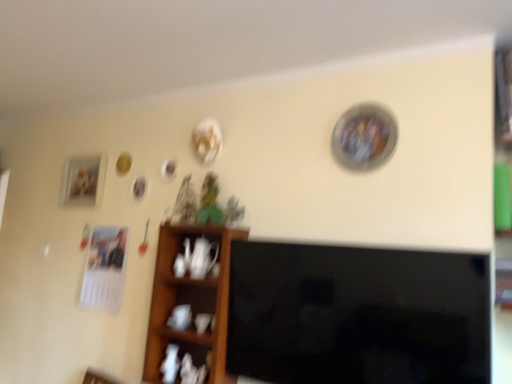
Question: Is black glossy tv at center bigger than wooden shelf at center?

Choices:
 (A) no
 (B) yes

Answer: (B)

Question: Can you confirm if black glossy tv at center is smaller than wooden shelf at center?

Choices:
 (A) no
 (B) yes

Answer: (A)

Question: From the image's perspective, would you say black glossy tv at center is shown under wooden shelf at center?

Choices:
 (A) yes
 (B) no

Answer: (B)

Question: From the image's perspective, is black glossy tv at center over wooden shelf at center?

Choices:
 (A) no
 (B) yes

Answer: (B)

Question: From a real-world perspective, is black glossy tv at center on wooden shelf at center?

Choices:
 (A) no
 (B) yes

Answer: (B)

Question: Could wooden shelf at center be considered to be inside black glossy tv at center?

Choices:
 (A) no
 (B) yes

Answer: (A)

Question: Does wooden shelf at center appear on the left side of matte wooden picture frame at left?

Choices:
 (A) yes
 (B) no

Answer: (B)

Question: Does wooden shelf at center lie behind matte wooden picture frame at left?

Choices:
 (A) no
 (B) yes

Answer: (A)

Question: Is wooden shelf at center oriented away from matte wooden picture frame at left?

Choices:
 (A) no
 (B) yes

Answer: (A)

Question: Is the surface of wooden shelf at center in direct contact with matte wooden picture frame at left?

Choices:
 (A) no
 (B) yes

Answer: (A)

Question: Can you confirm if wooden shelf at center is smaller than matte wooden picture frame at left?

Choices:
 (A) no
 (B) yes

Answer: (A)

Question: Does wooden shelf at center have a greater height compared to matte wooden picture frame at left?

Choices:
 (A) yes
 (B) no

Answer: (A)

Question: Is wooden shelf at center far away from black glossy tv at center?

Choices:
 (A) no
 (B) yes

Answer: (A)